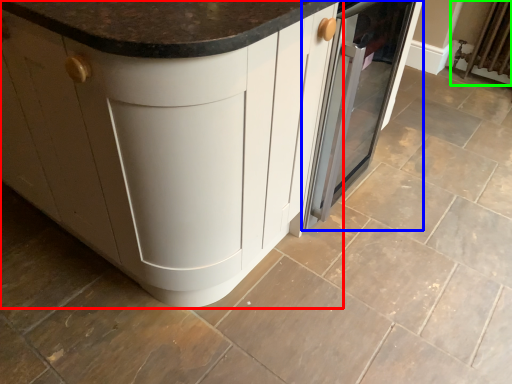
Question: Which is nearer to the cabinetry (highlighted by a red box)? home appliance (highlighted by a blue box) or radiator (highlighted by a green box).

Choices:
 (A) home appliance
 (B) radiator

Answer: (A)